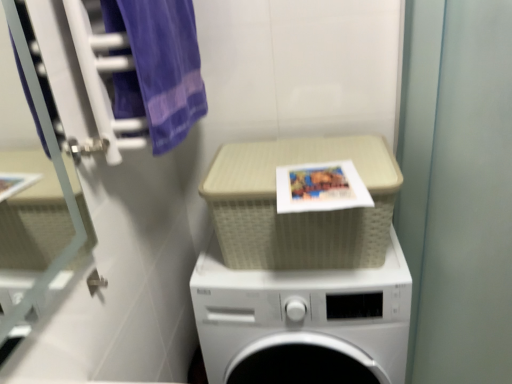
Question: In terms of height, does matte paper book cover at center look taller or shorter compared to transparent glass door at left?

Choices:
 (A) tall
 (B) short

Answer: (B)

Question: From a real-world perspective, is matte paper book cover at center positioned above or below transparent glass door at left?

Choices:
 (A) above
 (B) below

Answer: (B)

Question: Which object is positioned closest to the green matte screen door at right?

Choices:
 (A) transparent glass door at left
 (B) purple cotton towel at upper left
 (C) matte paper book cover at center
 (D) white plastic washing machine at center

Answer: (D)

Question: Based on their relative distances, which object is farther from the purple cotton towel at upper left?

Choices:
 (A) white plastic washing machine at center
 (B) transparent glass door at left
 (C) green matte screen door at right
 (D) matte paper book cover at center

Answer: (C)